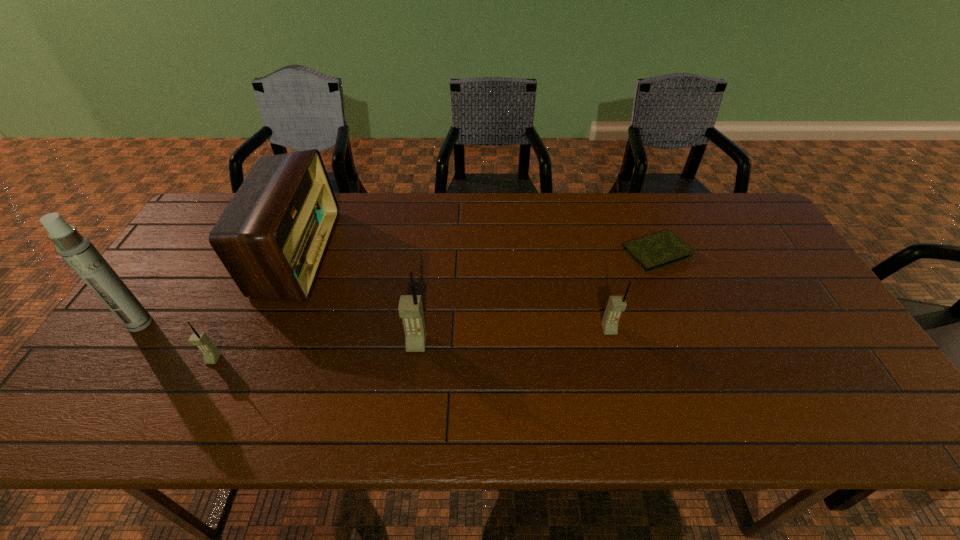
Where is `vacant space that satisfies the following two spatial constraints: 1. on the front side of the shortest object; 2. on the front-facing side of the radio receiver`? Image resolution: width=960 pixels, height=540 pixels. vacant space that satisfies the following two spatial constraints: 1. on the front side of the shortest object; 2. on the front-facing side of the radio receiver is located at coordinates (657, 253).

At what (x,y) coordinates should I click in order to perform the action: click on vacant region that satisfies the following two spatial constraints: 1. on the front-facing side of the radio receiver; 2. on the front of the shortest cellular telephone, where the keypad is located. Please return your answer as a coordinate pair (x, y). The width and height of the screenshot is (960, 540). Looking at the image, I should click on click(x=251, y=359).